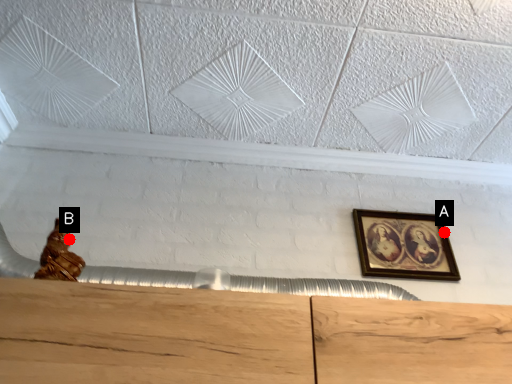
Question: Two points are circled on the image, labeled by A and B beside each circle. Which point is closer to the camera taking this photo?

Choices:
 (A) A is closer
 (B) B is closer

Answer: (B)